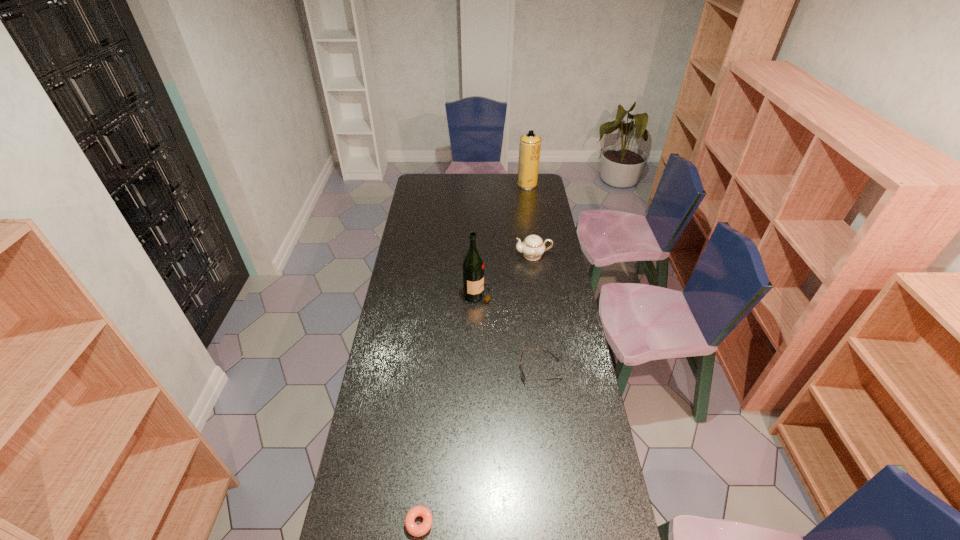
The width and height of the screenshot is (960, 540). I want to click on unoccupied position between the wine bottle and the farthest object, so coord(503,239).

This screenshot has height=540, width=960. In order to click on free space between the fourth farthest object and the nearest object in this screenshot , I will do `click(480, 447)`.

Find the location of `free space between the fourth nearest object and the aerosol can`. free space between the fourth nearest object and the aerosol can is located at coordinates (530, 220).

At what (x,y) coordinates should I click in order to perform the action: click on free space that is in between the second farthest object and the sunglasses. Please return your answer as a coordinate pair (x, y). Image resolution: width=960 pixels, height=540 pixels. Looking at the image, I should click on (537, 313).

This screenshot has width=960, height=540. I want to click on free point between the doughnut and the chinaware, so 476,389.

The image size is (960, 540). In order to click on free space that is in between the aerosol can and the third farthest object in this screenshot , I will do `click(503, 239)`.

Identify which object is the second nearest to the chinaware. Please provide its 2D coordinates. Your answer should be formatted as a tuple, i.e. [(x, y)], where the tuple contains the x and y coordinates of a point satisfying the conditions above.

[(521, 370)]

Find the location of `object that is the fourth closest to the nearest object`. object that is the fourth closest to the nearest object is located at coordinates (529, 150).

This screenshot has width=960, height=540. Identify the location of blank space that satisfies the following two spatial constraints: 1. on the front side of the farthest object; 2. on the front-facing side of the second shortest object. (556, 370).